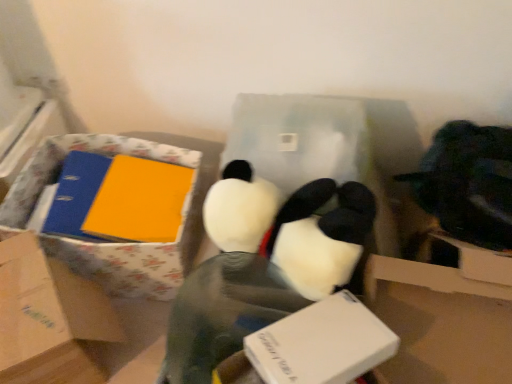
Identify the location of white fluffy plush at center. (222, 313).

This screenshot has height=384, width=512. What do you see at coordinates (115, 243) in the screenshot?
I see `floral-patterned cardboard box at left` at bounding box center [115, 243].

Identify the location of blue matte binder at left. click(76, 195).

This screenshot has width=512, height=384. I want to click on white plush toy at center, so click(262, 264).

Locate an element on the screen. The image size is (512, 384). white fluffy plush at center is located at coordinates (222, 313).

Is matte yellow book at left next to floral-patterned cardboard box at left?

No, matte yellow book at left is not with floral-patterned cardboard box at left.

In the scene shown: Between matte yellow book at left and floral-patterned cardboard box at left, which one is positioned behind?

matte yellow book at left is further away from the camera.

Looking at this image, from the image's perspective, between matte yellow book at left and floral-patterned cardboard box at left, who is located below?

From the image's view, matte yellow book at left is below.

Where is `book that appears below the floral-patterned cardboard box at left (from the image's perspective)`? This screenshot has height=384, width=512. book that appears below the floral-patterned cardboard box at left (from the image's perspective) is located at coordinates (118, 199).

The image size is (512, 384). What are the coordinates of `toy above the floral-patterned cardboard box at left (from a real-world perspective)` in the screenshot? It's located at (262, 264).

How many degrees apart are the facing directions of white plush toy at center and floral-patterned cardboard box at left?

36.3 degrees separate the facing orientations of white plush toy at center and floral-patterned cardboard box at left.

In the scene shown: Is white plush toy at center facing towards floral-patterned cardboard box at left?

No, white plush toy at center is not aimed at floral-patterned cardboard box at left.

Can you confirm if white plush toy at center is taller than floral-patterned cardboard box at left?

Yes, white plush toy at center is taller than floral-patterned cardboard box at left.

From the picture: Does white fluffy plush at center have a lesser width compared to white plush toy at center?

Correct, the width of white fluffy plush at center is less than that of white plush toy at center.

Considering the relative sizes of white fluffy plush at center and white plush toy at center in the image provided, is white fluffy plush at center smaller than white plush toy at center?

No, white fluffy plush at center is not smaller than white plush toy at center.

Between white fluffy plush at center and white plush toy at center, which one has less height?

Standing shorter between the two is white plush toy at center.

Which is more to the right, white fluffy plush at center or white plush toy at center?

From the viewer's perspective, white plush toy at center appears more on the right side.

Which is behind, white plastic box at center, acting as the first box starting from the right, or white fluffy plush at center?

white fluffy plush at center is more distant.

Is white plastic box at center, placed as the second box when sorted from left to right, facing towards white fluffy plush at center?

Yes, white plastic box at center, placed as the second box when sorted from left to right, is oriented towards white fluffy plush at center.

From a real-world perspective, is white plastic box at center, placed as the second box when sorted from left to right, on top of white fluffy plush at center?

Yes.

Between white plastic box at center, acting as the first box starting from the right, and white fluffy plush at center, which one has larger width?

white plastic box at center, acting as the first box starting from the right, is wider.

Looking at this image, which is closer to the camera, [49,262] or [360,339]?

Positioned in front is point [360,339].

Is the surface of matte cardboard box at left, the 2th box positioned from the right, in direct contact with white plastic box at center, acting as the first box starting from the right?

No, matte cardboard box at left, the 2th box positioned from the right, is not next to white plastic box at center, acting as the first box starting from the right.

In the image, is matte cardboard box at left, the 1th box from the left, on the left side or the right side of white plastic box at center, acting as the first box starting from the right?

From the image, it's evident that matte cardboard box at left, the 1th box from the left, is to the left of white plastic box at center, acting as the first box starting from the right.

From the picture: In terms of width, does matte cardboard box at left, the 1th box from the left, look wider or thinner when compared to white plastic box at center, acting as the first box starting from the right?

Considering their sizes, matte cardboard box at left, the 1th box from the left, looks broader than white plastic box at center, acting as the first box starting from the right.

Is blue matte binder at left shorter than matte cardboard box at left, the 1th box from the left?

Indeed, blue matte binder at left has a lesser height compared to matte cardboard box at left, the 1th box from the left.

Considering the positions of objects blue matte binder at left and matte cardboard box at left, the 2th box positioned from the right, in the image provided, who is more to the right, blue matte binder at left or matte cardboard box at left, the 2th box positioned from the right,?

matte cardboard box at left, the 2th box positioned from the right.

Is matte cardboard box at left, the 2th box positioned from the right, a part of blue matte binder at left?

No, matte cardboard box at left, the 2th box positioned from the right, is not a part of blue matte binder at left.

Does point (82, 235) come closer to viewer compared to point (24, 313)?

No, (82, 235) is behind (24, 313).

Is blue matte binder at left beside white plush toy at center?

No, blue matte binder at left is not with white plush toy at center.

Measure the distance between blue matte binder at left and white plush toy at center.

blue matte binder at left is 19.68 inches from white plush toy at center.

Does blue matte binder at left have a lesser width compared to white plush toy at center?

In fact, blue matte binder at left might be wider than white plush toy at center.

Is blue matte binder at left completely or partially outside of white plush toy at center?

blue matte binder at left is positioned outside white plush toy at center.

Identify the location of cardboard box to the left of matte yellow book at left. (115, 243).

Identify the location of toy on the right of floral-patterned cardboard box at left. (262, 264).

Based on their spatial positions, is matte cardboard box at left, the 2th box positioned from the right, or white fluffy plush at center further from floral-patterned cardboard box at left?

white fluffy plush at center.

Estimate the real-world distances between objects in this image. Which object is further from white plastic box at center, placed as the second box when sorted from left to right, white plush toy at center or white fluffy plush at center?

white plush toy at center is positioned further to the anchor white plastic box at center, placed as the second box when sorted from left to right.

Which object lies nearer to the anchor point white plush toy at center, floral-patterned cardboard box at left or matte yellow book at left?

floral-patterned cardboard box at left is closer to white plush toy at center.

When comparing their distances from blue matte binder at left, does floral-patterned cardboard box at left or white plush toy at center seem further?

Among the two, white plush toy at center is located further to blue matte binder at left.

Looking at the image, which one is located closer to white plush toy at center, white plastic box at center, placed as the second box when sorted from left to right, or matte yellow book at left?

white plastic box at center, placed as the second box when sorted from left to right, lies closer to white plush toy at center than the other object.

Considering their positions, is blue matte binder at left positioned closer to white plush toy at center than matte cardboard box at left, the 2th box positioned from the right?

Among the two, matte cardboard box at left, the 2th box positioned from the right, is located nearer to white plush toy at center.

Considering their positions, is white fluffy plush at center positioned further to matte yellow book at left than floral-patterned cardboard box at left?

white fluffy plush at center lies further to matte yellow book at left than the other object.

When comparing their distances from white fluffy plush at center, does blue matte binder at left or matte yellow book at left seem closer?

Based on the image, matte yellow book at left appears to be nearer to white fluffy plush at center.

Find the location of `cardboard box between blue matte binder at left and matte cardboard box at left, the 2th box positioned from the right, in the vertical direction`. cardboard box between blue matte binder at left and matte cardboard box at left, the 2th box positioned from the right, in the vertical direction is located at coordinates (115, 243).

You are a GUI agent. You are given a task and a screenshot of the screen. Output one action in this format:
    pyautogui.click(x=<x>, y=<y>)
    Task: Click on the cardboard box located between white plastic box at center, placed as the second box when sorted from left to right, and matte yellow book at left in the depth direction
    The width and height of the screenshot is (512, 384).
    Given the screenshot: What is the action you would take?
    pyautogui.click(x=115, y=243)

This screenshot has width=512, height=384. Identify the location of clothing located between matte cardboard box at left, the 1th box from the left, and white plastic box at center, acting as the first box starting from the right, in the left-right direction. (222, 313).

The image size is (512, 384). Find the location of `cardboard box between matte cardboard box at left, the 2th box positioned from the right, and white plush toy at center, in the horizontal direction`. cardboard box between matte cardboard box at left, the 2th box positioned from the right, and white plush toy at center, in the horizontal direction is located at coordinates (115, 243).